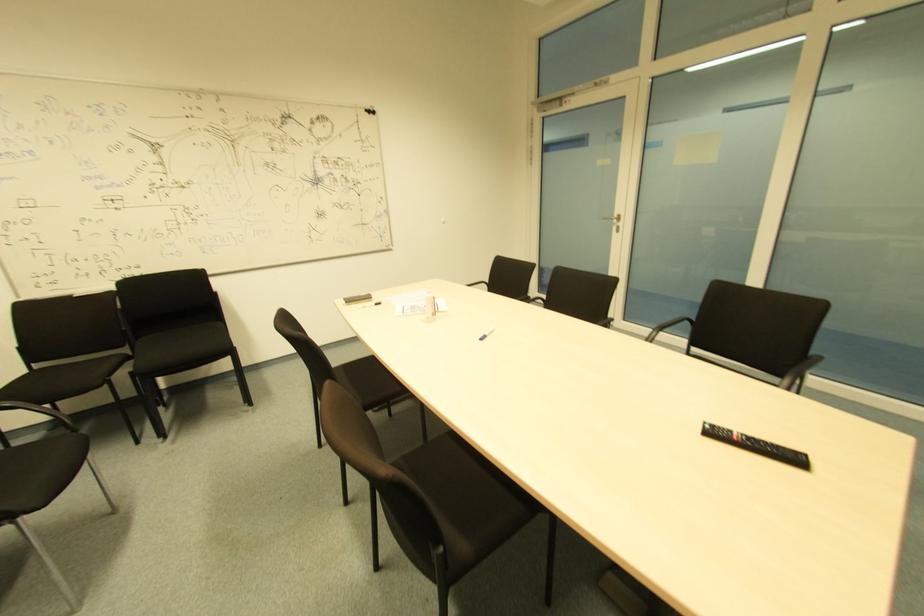
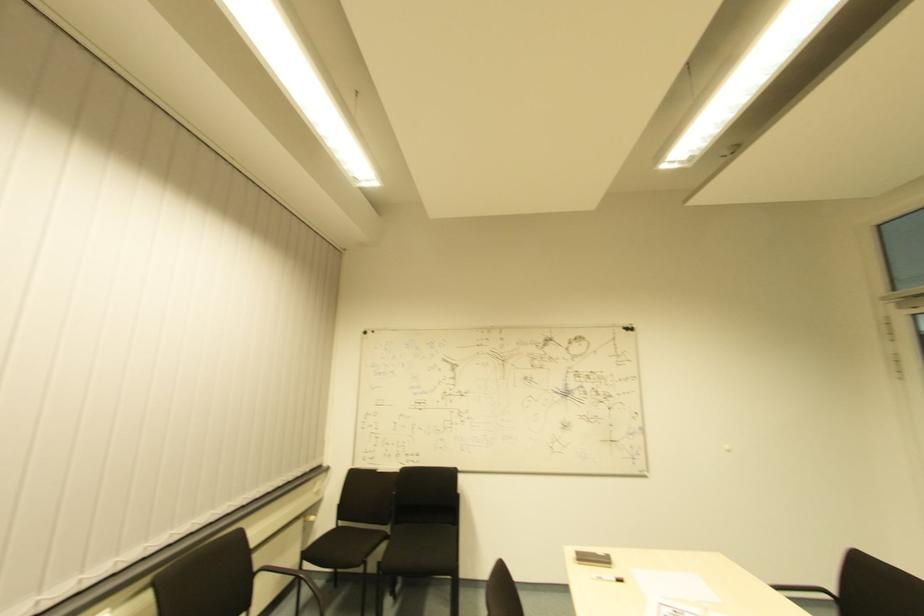
First-person continuous shooting, in which direction is the camera rotating?

The camera rotated toward left-up.